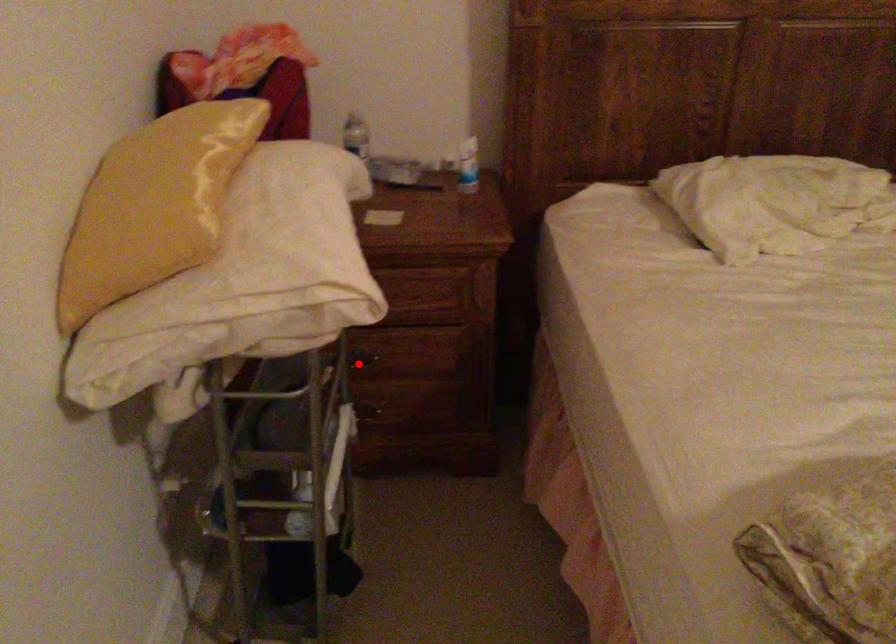
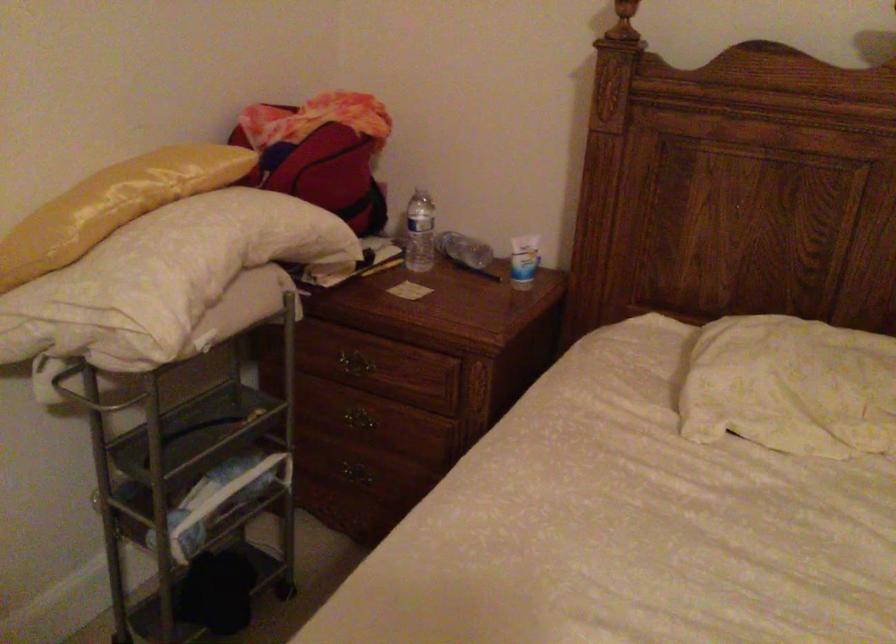
Locate, in the second image, the point that corresponds to the highlighted location in the first image.

(357, 426)